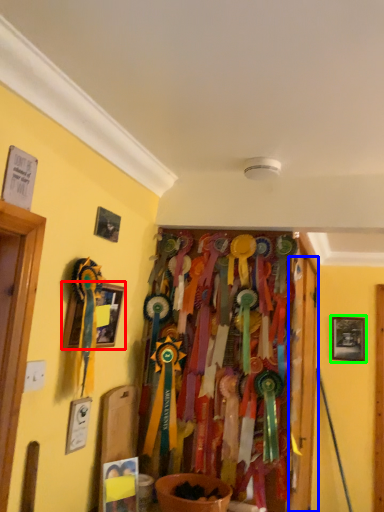
Question: Based on their relative distances, which object is nearer to picture frame (highlighted by a red box)? Choose from door (highlighted by a blue box) and picture frame (highlighted by a green box).

Choices:
 (A) door
 (B) picture frame

Answer: (A)